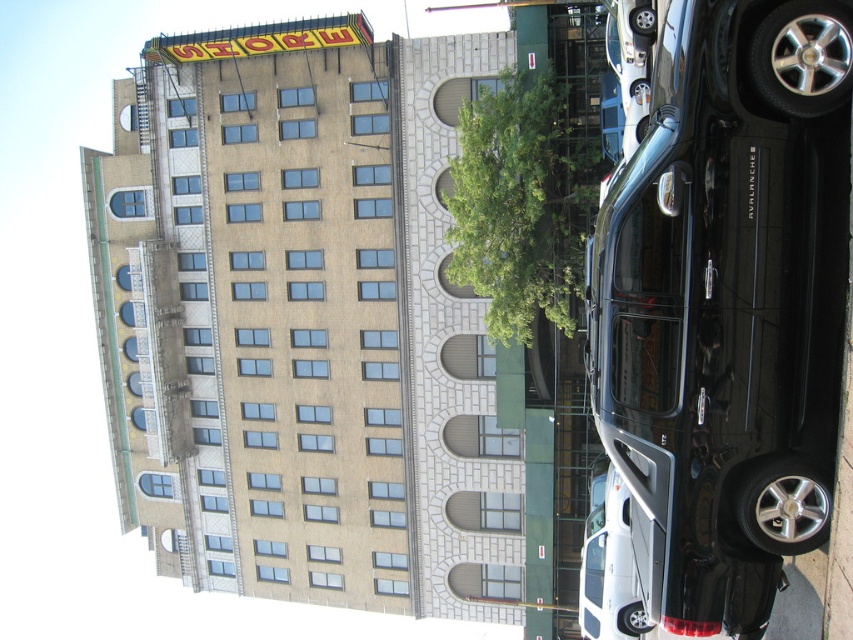
Question: Which point is farther from the camera taking this photo?

Choices:
 (A) [x=737, y=138]
 (B) [x=570, y=140]

Answer: (B)

Question: Observing the image, what is the correct spatial positioning of black glossy suv at right in reference to green leafy tree at center?

Choices:
 (A) left
 (B) right

Answer: (B)

Question: Which point is closer to the camera?

Choices:
 (A) green leafy tree at center
 (B) black glossy suv at right

Answer: (B)

Question: Is black glossy suv at right behind green leafy tree at center?

Choices:
 (A) yes
 (B) no

Answer: (B)

Question: From the image, what is the correct spatial relationship of black glossy suv at right in relation to green leafy tree at center?

Choices:
 (A) below
 (B) above

Answer: (A)

Question: Which object is farther from the camera taking this photo?

Choices:
 (A) green leafy tree at center
 (B) black glossy suv at right

Answer: (A)